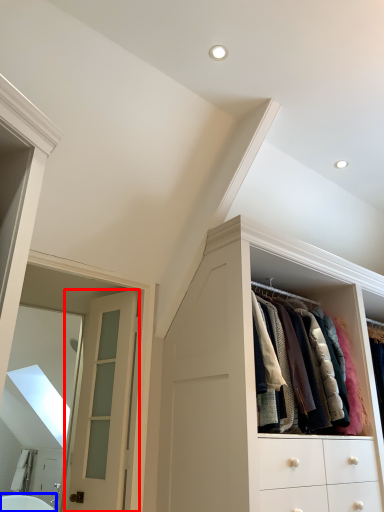
Question: Which object is further to the camera taking this photo, door (highlighted by a red box) or bath (highlighted by a blue box)?

Choices:
 (A) door
 (B) bath

Answer: (B)